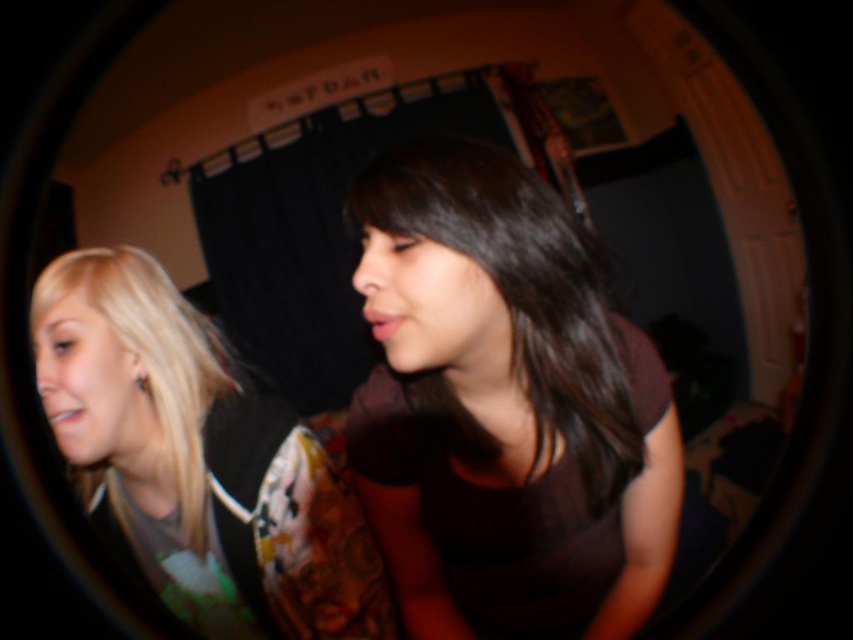
Question: Which of the following is the closest to the observer?

Choices:
 (A) blonde hair at left
 (B) dark brown fabric at center

Answer: (B)

Question: Does dark brown fabric at center appear on the right side of blonde hair at left?

Choices:
 (A) yes
 (B) no

Answer: (A)

Question: Among these points, which one is nearest to the camera?

Choices:
 (A) (633, 396)
 (B) (167, 454)

Answer: (A)

Question: Can you confirm if dark brown fabric at center is smaller than blonde hair at left?

Choices:
 (A) no
 (B) yes

Answer: (B)

Question: Can you confirm if dark brown fabric at center is bigger than blonde hair at left?

Choices:
 (A) no
 (B) yes

Answer: (A)